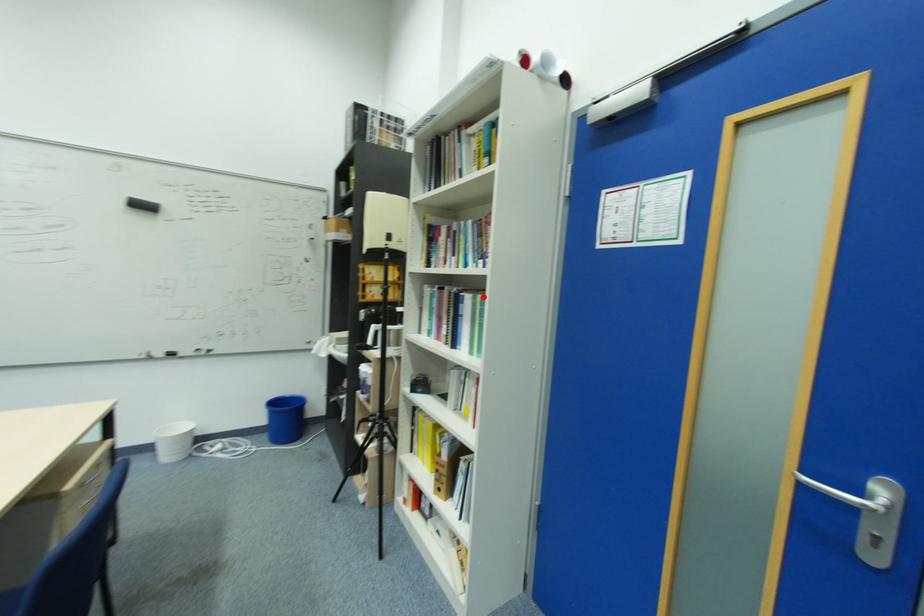
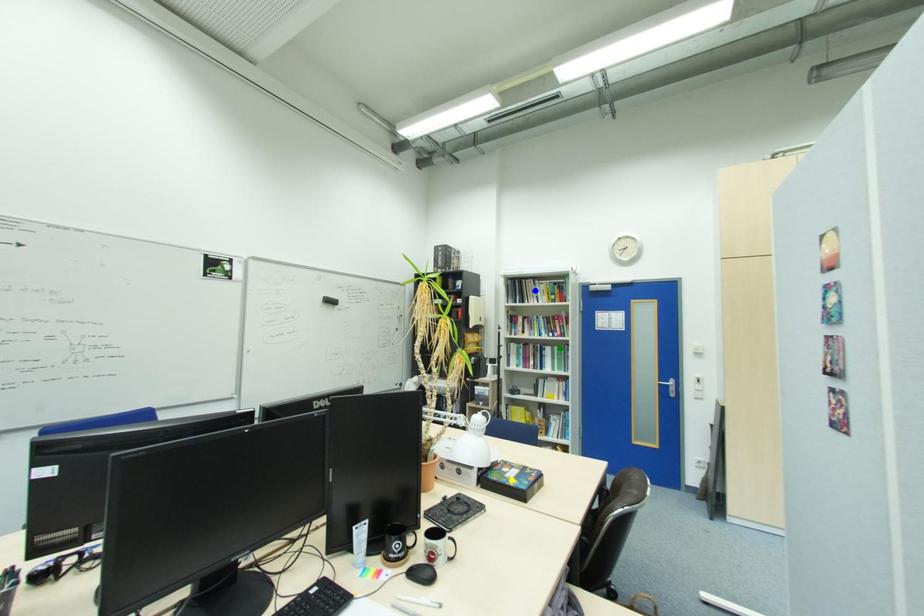
Question: I am providing you with two images of the same scene from different viewpoints. A red point is marked on the first image. You are given multiple points on the second image. Which point in image 2 is actually the same real-world point as the red point in image 1?

Choices:
 (A) yellow point
 (B) blue point
 (C) green point

Answer: (C)